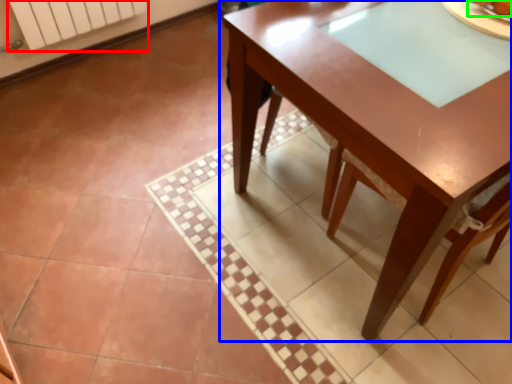
Question: Based on their relative distances, which object is nearer to radiator (highlighted by a red box)? Choose from table (highlighted by a blue box) and food (highlighted by a green box).

Choices:
 (A) table
 (B) food

Answer: (A)